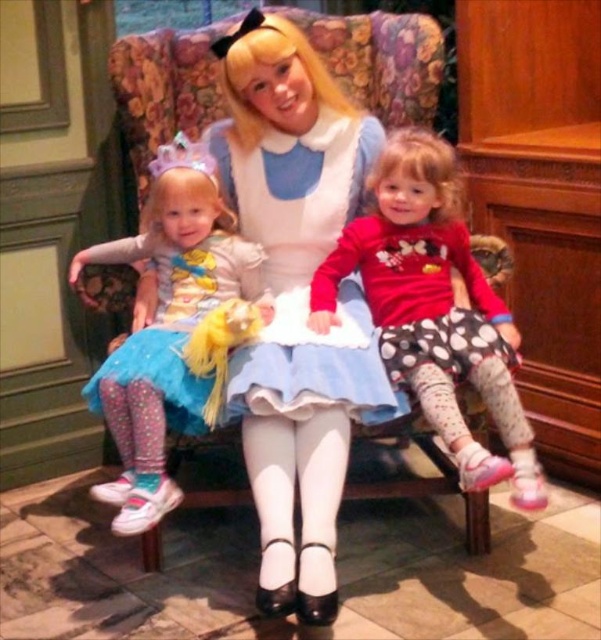
Who is taller, polka dot skirt at center or matte white dress at center?

Standing taller between the two is polka dot skirt at center.

Is polka dot skirt at center taller than matte white dress at center?

Yes, polka dot skirt at center is taller than matte white dress at center.

Is point (406, 172) farther from camera compared to point (213, 148)?

No, (406, 172) is in front of (213, 148).

The height and width of the screenshot is (640, 601). I want to click on polka dot skirt at center, so tap(433, 308).

Between floral fabric armchair at center and matte white dress at center, which one appears on the left side from the viewer's perspective?

Positioned to the left is floral fabric armchair at center.

Which is in front, point (294, 188) or point (294, 296)?

Point (294, 296) is in front.

Find the location of a particular element. The image size is (601, 640). floral fabric armchair at center is located at coordinates click(382, 60).

Is point (356, 314) positioned behind point (204, 276)?

No, (356, 314) is closer to viewer.

Who is more distant from viewer, (296, 417) or (192, 301)?

The point (192, 301) is behind.

Locate an element on the screen. This screenshot has height=640, width=601. matte white dress at center is located at coordinates (305, 269).